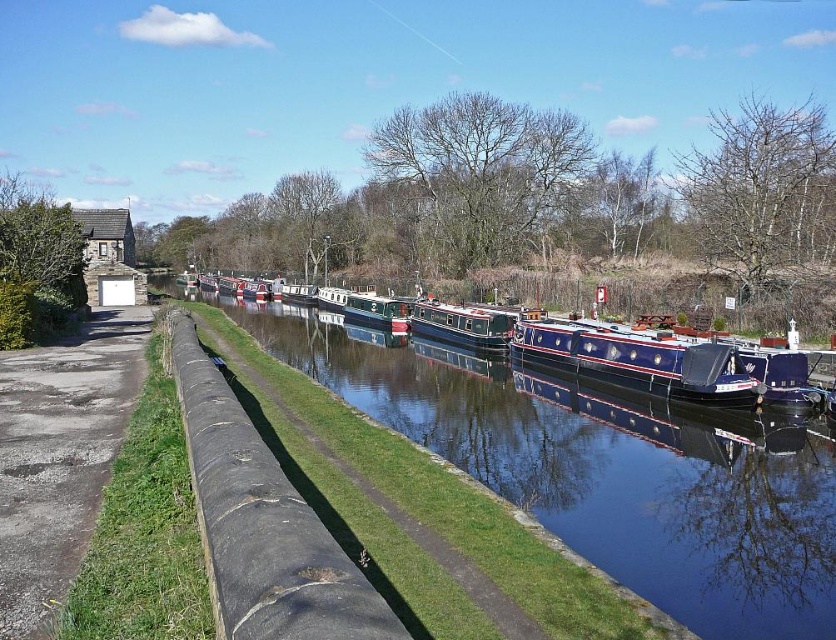
Between rough concrete wall at lower left and blue polished wood barge at center, which one appears on the right side from the viewer's perspective?

Positioned to the right is blue polished wood barge at center.

Who is taller, rough concrete wall at lower left or blue polished wood barge at center?

blue polished wood barge at center is taller.

Does point (314, 545) come in front of point (712, 369)?

Yes, it is.

The image size is (836, 640). What are the coordinates of `rough concrete wall at lower left` in the screenshot? It's located at (261, 522).

Can you confirm if green polished wooden boat at center is bigger than green glossy canal boat at center?

Actually, green polished wooden boat at center might be smaller than green glossy canal boat at center.

Can you confirm if green polished wooden boat at center is positioned below green glossy canal boat at center?

Yes.

Is point (370, 305) less distant than point (307, 301)?

Yes, it is in front of point (307, 301).

You are a GUI agent. You are given a task and a screenshot of the screen. Output one action in this format:
    pyautogui.click(x=<x>, y=<y>)
    Task: Click on the green polished wooden boat at center
    
    Given the screenshot: What is the action you would take?
    pyautogui.click(x=376, y=312)

Consider the image. Who is more distant from viewer, (x=427, y=312) or (x=345, y=296)?

The point (x=345, y=296) is more distant.

Is blue polished wooden boat at center to the left of green polished wooden boat at center from the viewer's perspective?

In fact, blue polished wooden boat at center is to the right of green polished wooden boat at center.

Does point (436, 304) lie in front of point (350, 300)?

Yes.

At what (x,y) coordinates should I click in order to perform the action: click on blue polished wooden boat at center. Please return your answer as a coordinate pair (x, y). Looking at the image, I should click on (462, 324).